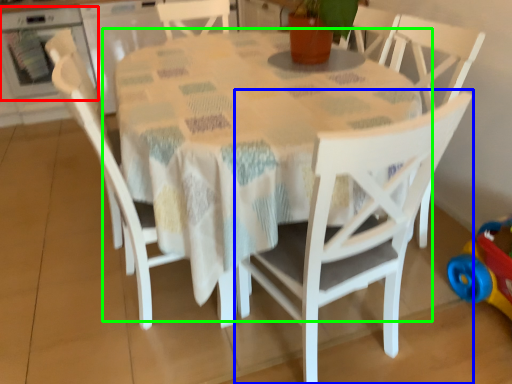
Question: Considering the real-world distances, which object is farthest from oven (highlighted by a red box)? chair (highlighted by a blue box) or table (highlighted by a green box)?

Choices:
 (A) chair
 (B) table

Answer: (A)